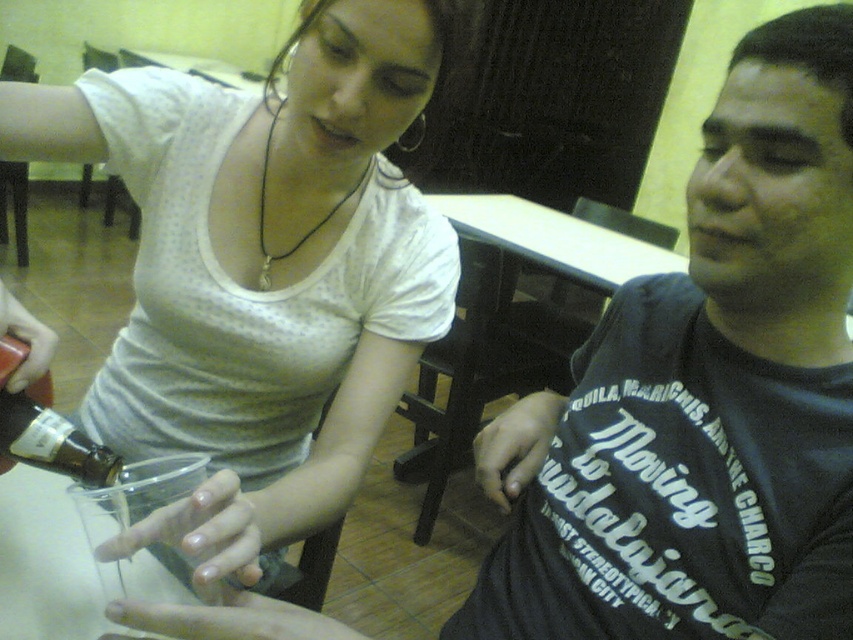
From the picture: You are a customer in the restaurant and want to take a photo of the matte white shirt at upper left and the white plastic table at center. Which object should you focus on first to ensure it is in the foreground of your photo?

The matte white shirt at upper left has a lesser height compared to the white plastic table at center, so you should focus on the matte white shirt at upper left first to ensure it is in the foreground.

You are a customer at the restaurant and want to place your phone on the table without it sliding off. Considering the white plastic table at center and the matte glass bottle at lower left, which surface is more stable?

The white plastic table at center is more stable because it is positioned over the matte glass bottle at lower left, providing a larger and flatter surface area for placing the phone.